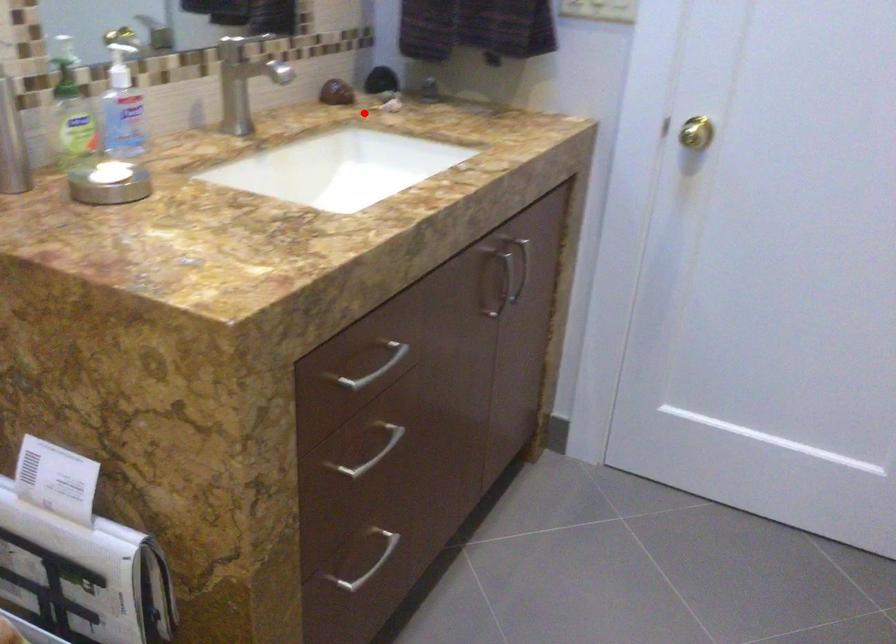
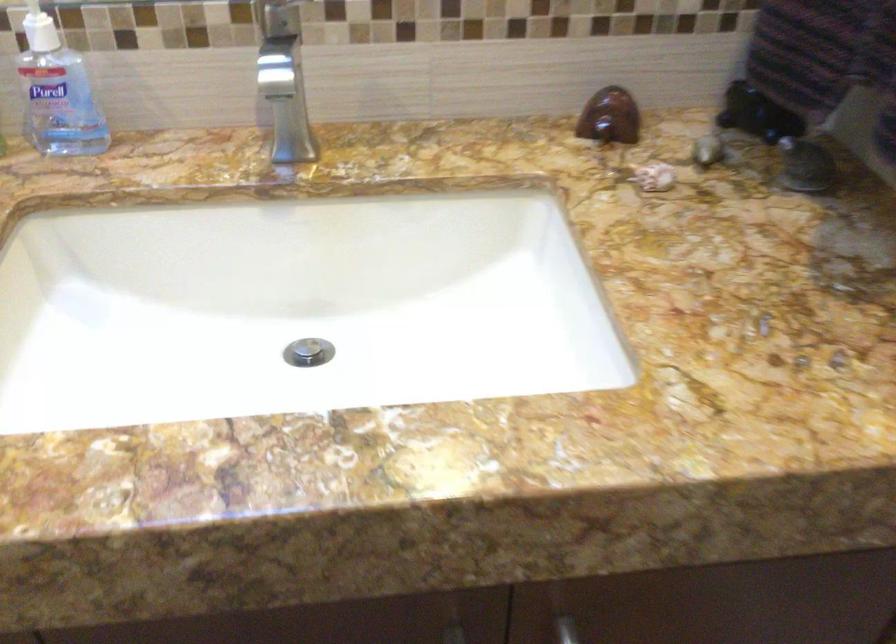
The point at the highlighted location is marked in the first image. Where is the corresponding point in the second image?

(609, 117)